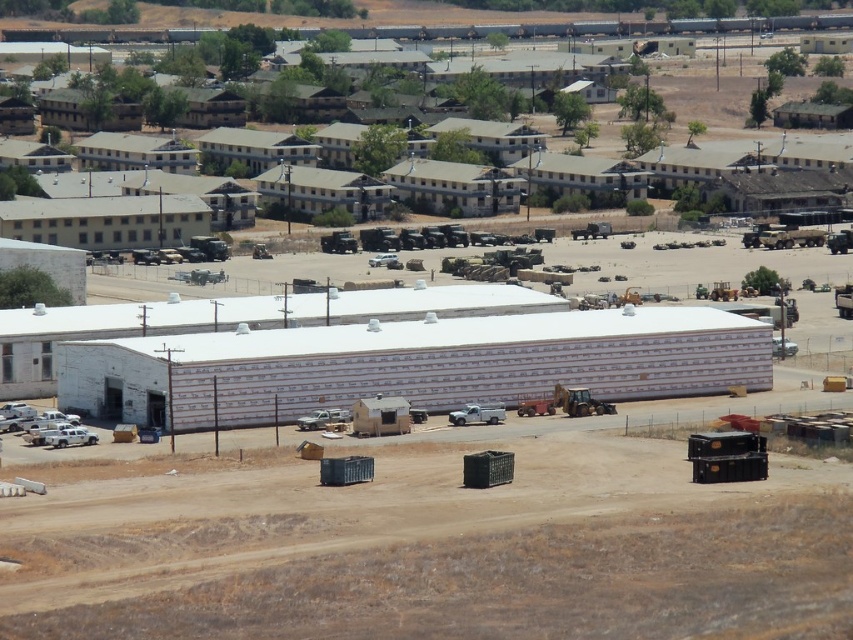
Is brown dirt field at lower center above gray concrete buildings at upper center?

No.

What do you see at coordinates (442, 552) in the screenshot?
I see `brown dirt field at lower center` at bounding box center [442, 552].

Does point (264, 609) lie in front of point (717, 33)?

Yes, it is.

The image size is (853, 640). I want to click on brown dirt field at lower center, so click(442, 552).